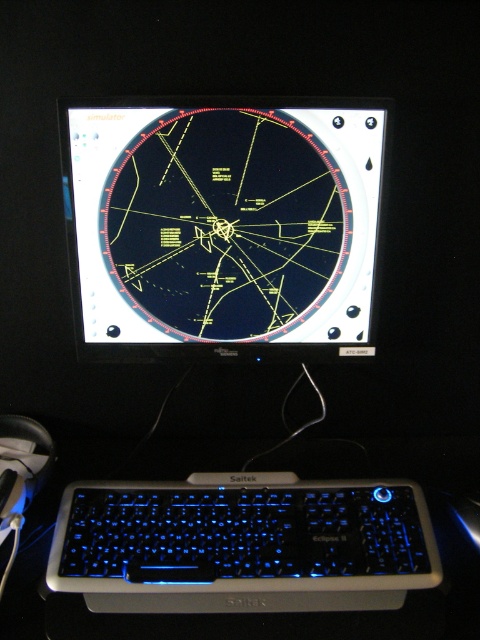
Question: Which object appears farthest from the camera in this image?

Choices:
 (A) black plastic monitor at center
 (B) blue illuminated plastic keyboard at bottom
 (C) black glossy monitor at center

Answer: (C)

Question: Does black plastic monitor at center appear on the right side of blue illuminated plastic keyboard at bottom?

Choices:
 (A) no
 (B) yes

Answer: (A)

Question: Can you confirm if black plastic monitor at center is positioned to the left of blue illuminated plastic keyboard at bottom?

Choices:
 (A) yes
 (B) no

Answer: (A)

Question: Based on their relative distances, which object is nearer to the black glossy monitor at center?

Choices:
 (A) black plastic monitor at center
 (B) blue illuminated plastic keyboard at bottom

Answer: (A)

Question: Considering the real-world distances, which object is closest to the black plastic monitor at center?

Choices:
 (A) black glossy monitor at center
 (B) blue illuminated plastic keyboard at bottom

Answer: (A)

Question: Considering the relative positions of black plastic monitor at center and blue illuminated plastic keyboard at bottom in the image provided, where is black plastic monitor at center located with respect to blue illuminated plastic keyboard at bottom?

Choices:
 (A) above
 (B) below

Answer: (A)